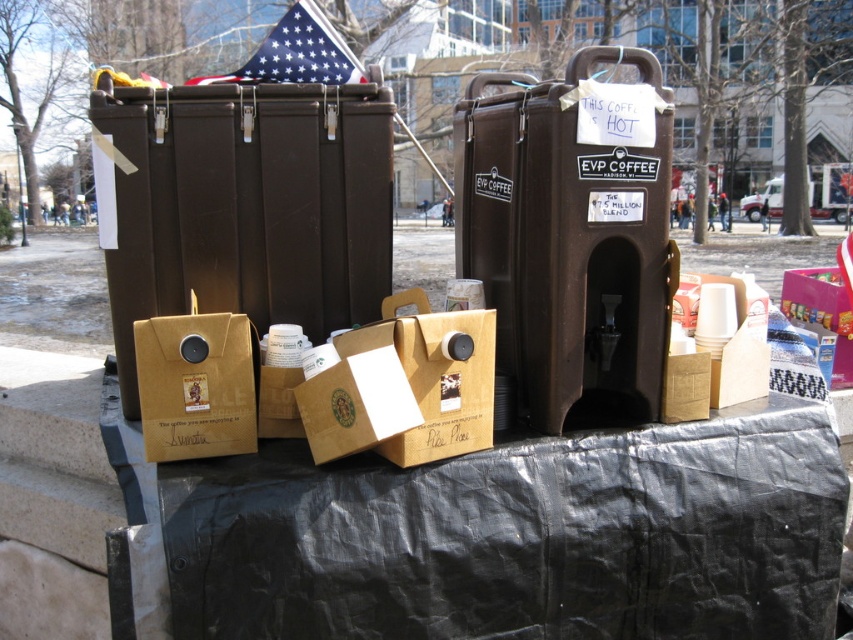
Question: Among these objects, which one is nearest to the camera?

Choices:
 (A) brown paper bag at center
 (B) matte brown cardboard box at center

Answer: (B)

Question: Does matte brown cardboard box at center appear under brown paper bag at center?

Choices:
 (A) no
 (B) yes

Answer: (A)

Question: From the image, what is the correct spatial relationship of matte brown cardboard box at center in relation to brown paper bag at center?

Choices:
 (A) below
 (B) above

Answer: (B)

Question: Does matte brown cardboard box at center appear on the left side of brown paper bag at center?

Choices:
 (A) no
 (B) yes

Answer: (A)

Question: Among these points, which one is farthest from the camera?

Choices:
 (A) (242, 378)
 (B) (450, 381)

Answer: (A)

Question: Among these points, which one is nearest to the camera?

Choices:
 (A) (235, 436)
 (B) (465, 444)

Answer: (A)